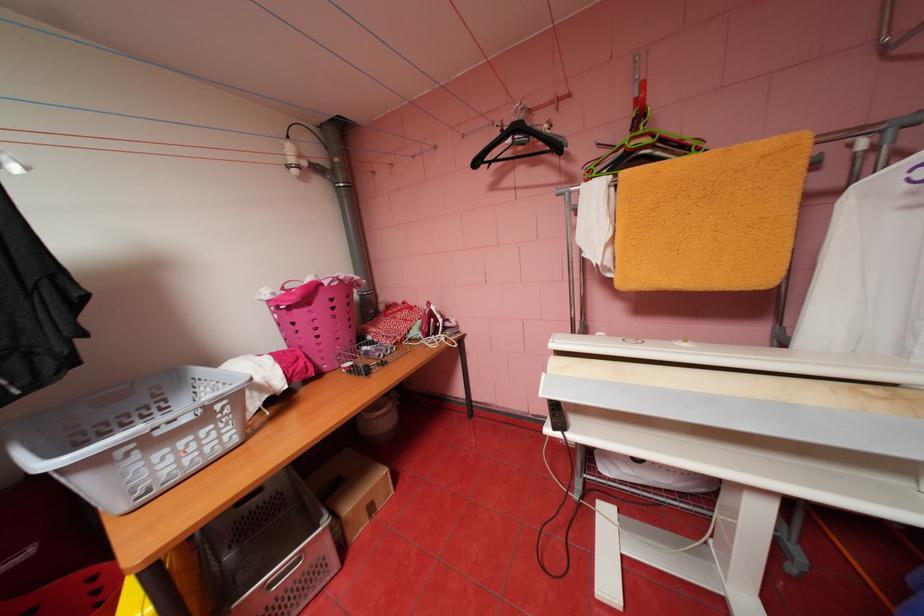
This screenshot has width=924, height=616. Identify the location of yellow push button. (685, 342).